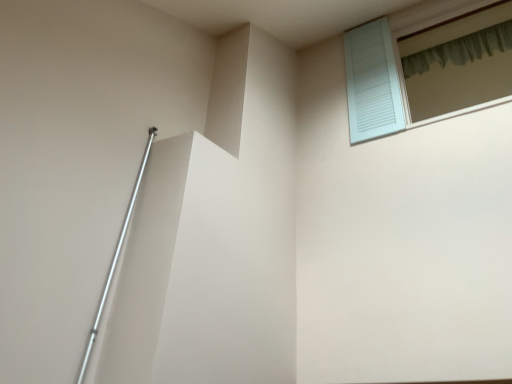
Question: From their relative heights in the image, would you say green fabric shower curtain at upper right is taller or shorter than light blue wooden window at upper right?

Choices:
 (A) tall
 (B) short

Answer: (B)

Question: Is point (426, 61) closer or farther from the camera than point (504, 74)?

Choices:
 (A) closer
 (B) farther

Answer: (A)

Question: From a real-world perspective, relative to light blue wooden window at upper right, is green fabric shower curtain at upper right vertically above or below?

Choices:
 (A) below
 (B) above

Answer: (B)

Question: Considering the positions of light blue wooden window at upper right and green fabric shower curtain at upper right in the image, is light blue wooden window at upper right wider or thinner than green fabric shower curtain at upper right?

Choices:
 (A) wide
 (B) thin

Answer: (A)

Question: From the image's perspective, is light blue wooden window at upper right positioned above or below green fabric shower curtain at upper right?

Choices:
 (A) above
 (B) below

Answer: (B)

Question: From a real-world perspective, is light blue wooden window at upper right physically located above or below green fabric shower curtain at upper right?

Choices:
 (A) below
 (B) above

Answer: (A)

Question: In terms of height, does light blue wooden window at upper right look taller or shorter compared to green fabric shower curtain at upper right?

Choices:
 (A) short
 (B) tall

Answer: (B)